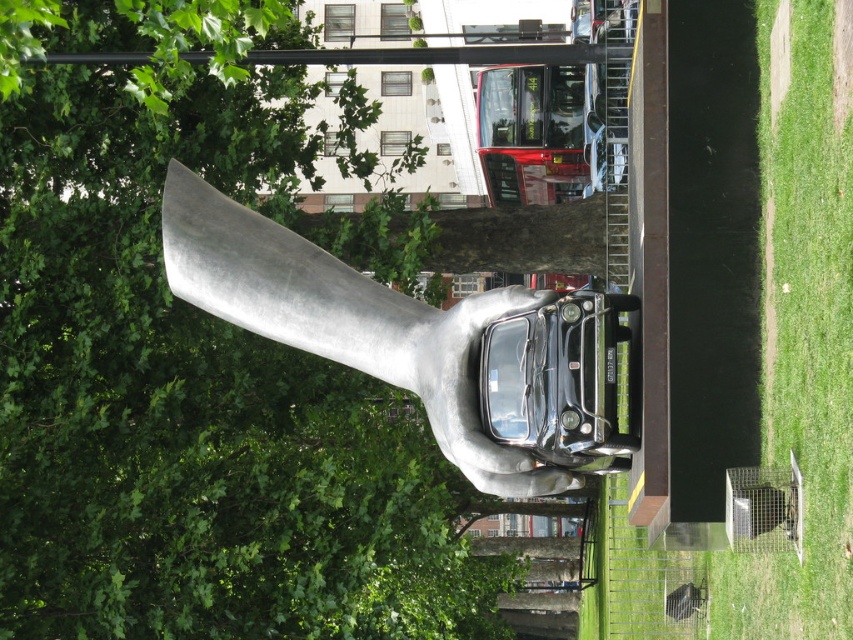
Question: Does green grass at lower right have a smaller size compared to shiny silver hand at center?

Choices:
 (A) no
 (B) yes

Answer: (A)

Question: Which point appears farthest from the camera in this image?

Choices:
 (A) tap(300, 250)
 (B) tap(740, 212)
 (C) tap(120, 371)

Answer: (C)

Question: Can you confirm if green leafy tree at upper center is positioned to the right of green grass at lower right?

Choices:
 (A) yes
 (B) no

Answer: (B)

Question: Which of these objects is positioned farthest from the green grass at lower right?

Choices:
 (A) green leafy tree at upper center
 (B) shiny silver hand at center

Answer: (A)

Question: Which point is farther from the camera taking this photo?

Choices:
 (A) (433, 435)
 (B) (709, 422)

Answer: (A)

Question: Does green grass at lower right appear over shiny silver hand at center?

Choices:
 (A) yes
 (B) no

Answer: (B)